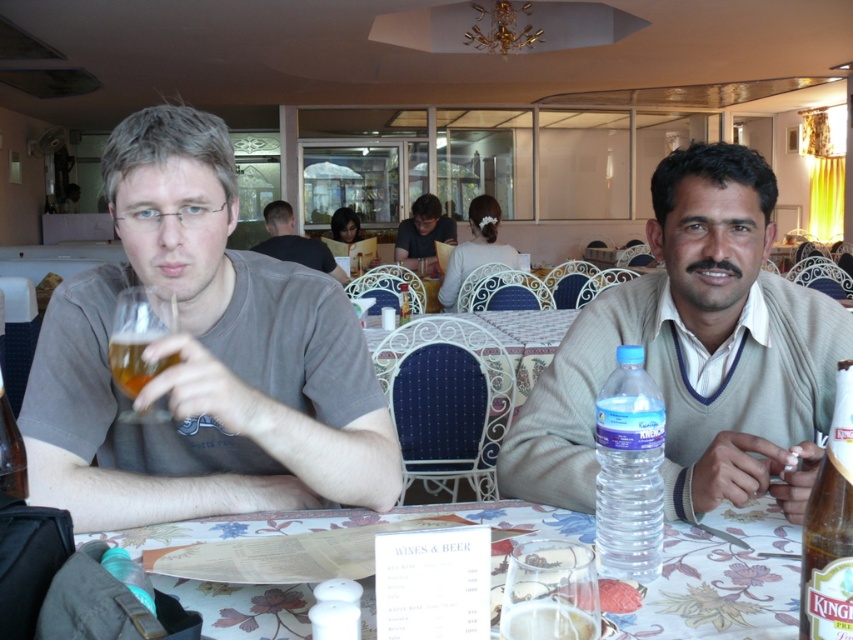
You are a server in a restaurant and need to retrieve the clear plastic bottle at table center and the clear glass bottle at table center. Which one is closer to the table surface?

The clear plastic bottle at table center is located below the clear glass bottle at table center, so it is closer to the table surface.

You are a customer sitting at the table with the white printed paper at center. You want to reach for the paper without moving your body. Can you do it comfortably?

The white printed paper at center is 67.78 centimeters from viewer, so you can comfortably reach it without moving your body.